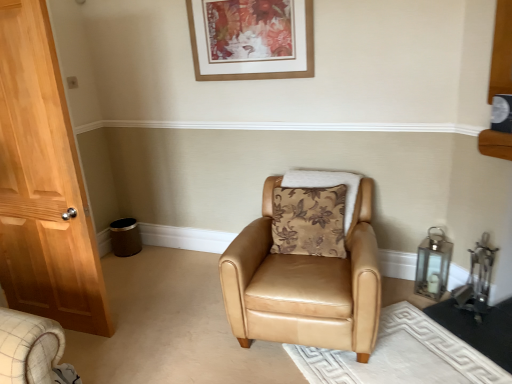
Question: Can you confirm if wooden picture frame at upper center is shorter than tan leather armchair at center?

Choices:
 (A) no
 (B) yes

Answer: (B)

Question: From the image's perspective, is wooden picture frame at upper center beneath tan leather armchair at center?

Choices:
 (A) yes
 (B) no

Answer: (B)

Question: Are wooden picture frame at upper center and tan leather armchair at center beside each other?

Choices:
 (A) yes
 (B) no

Answer: (B)

Question: Does wooden picture frame at upper center have a smaller size compared to tan leather armchair at center?

Choices:
 (A) no
 (B) yes

Answer: (B)

Question: Considering the relative sizes of wooden picture frame at upper center and tan leather armchair at center in the image provided, is wooden picture frame at upper center bigger than tan leather armchair at center?

Choices:
 (A) no
 (B) yes

Answer: (A)

Question: Is wooden picture frame at upper center thinner than tan leather armchair at center?

Choices:
 (A) no
 (B) yes

Answer: (B)

Question: Could brown floral fabric pillow at center be considered to be inside wooden picture frame at upper center?

Choices:
 (A) yes
 (B) no

Answer: (B)

Question: Considering the relative sizes of wooden picture frame at upper center and brown floral fabric pillow at center in the image provided, is wooden picture frame at upper center bigger than brown floral fabric pillow at center?

Choices:
 (A) yes
 (B) no

Answer: (B)

Question: Can you confirm if wooden picture frame at upper center is thinner than brown floral fabric pillow at center?

Choices:
 (A) yes
 (B) no

Answer: (A)

Question: From the image's perspective, is wooden picture frame at upper center located above brown floral fabric pillow at center?

Choices:
 (A) no
 (B) yes

Answer: (B)

Question: Is wooden picture frame at upper center to the right of brown floral fabric pillow at center from the viewer's perspective?

Choices:
 (A) no
 (B) yes

Answer: (A)

Question: Is wooden picture frame at upper center closer to camera compared to brown floral fabric pillow at center?

Choices:
 (A) no
 (B) yes

Answer: (A)

Question: Does tan leather armchair at center lie behind brown floral fabric pillow at center?

Choices:
 (A) no
 (B) yes

Answer: (A)